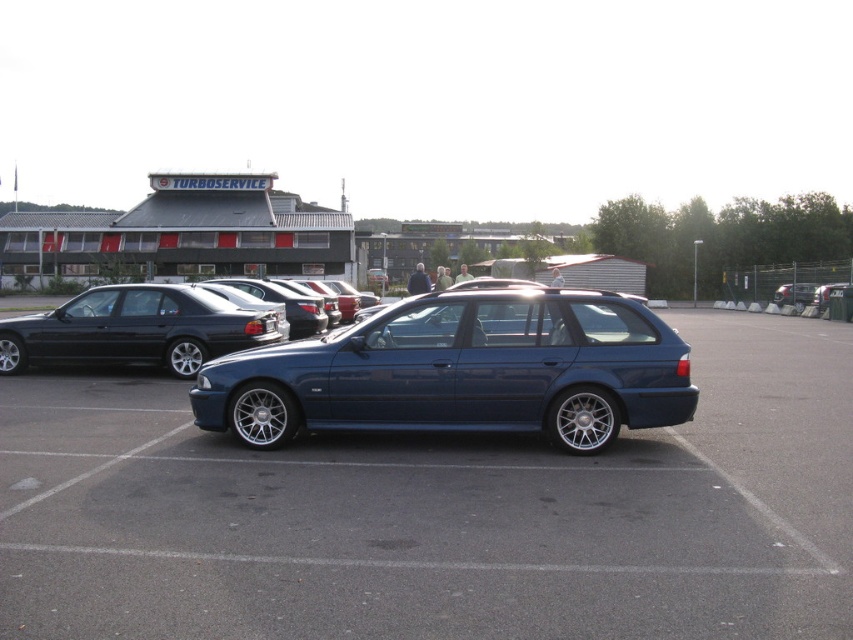
Question: In this image, where is metallic blue wagon at center located relative to glossy metallic car at center?

Choices:
 (A) right
 (B) left

Answer: (B)

Question: Which of the following is the closest to the observer?

Choices:
 (A) metallic blue car at center
 (B) glossy metallic car at center
 (C) metallic blue wagon at center

Answer: (A)

Question: Which of the following is the closest to the observer?

Choices:
 (A) (276, 321)
 (B) (189, 333)

Answer: (B)

Question: Can you confirm if metallic blue car at center is positioned below shiny black sedan at left?

Choices:
 (A) yes
 (B) no

Answer: (A)

Question: Which object is the farthest from the metallic blue car at center?

Choices:
 (A) glossy metallic car at center
 (B) shiny black sedan at left
 (C) black plastic license plate at center

Answer: (A)

Question: Can you confirm if shiny black sedan at left is positioned to the right of black plastic license plate at center?

Choices:
 (A) yes
 (B) no

Answer: (B)